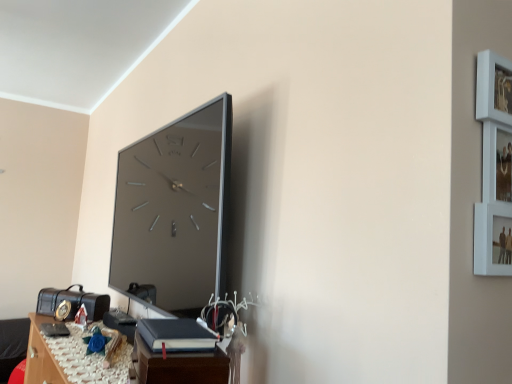
Question: Is wooden table at lower left, arranged as the second table when viewed from the right, not close to black leather book at lower center?

Choices:
 (A) no
 (B) yes

Answer: (A)

Question: Is wooden table at lower left, the 2th table in the top-to-bottom sequence, further to camera compared to black leather book at lower center?

Choices:
 (A) no
 (B) yes

Answer: (B)

Question: From a real-world perspective, is wooden table at lower left, which ranks as the 1th table in left-to-right order, located beneath black leather book at lower center?

Choices:
 (A) yes
 (B) no

Answer: (A)

Question: Is wooden table at lower left, the first table in the back-to-front sequence, surrounding black leather book at lower center?

Choices:
 (A) yes
 (B) no

Answer: (B)

Question: Does wooden table at lower left, the 2th table in the top-to-bottom sequence, come in front of black leather book at lower center?

Choices:
 (A) no
 (B) yes

Answer: (A)

Question: Is point (154, 375) closer or farther from the camera than point (174, 324)?

Choices:
 (A) closer
 (B) farther

Answer: (A)

Question: In the image, is wooden table at lower left, which is the second table from front to back, on the left side or the right side of black leather book at lower center?

Choices:
 (A) left
 (B) right

Answer: (A)

Question: Is wooden table at lower left, which ranks as the 1th table in left-to-right order, taller or shorter than black leather book at lower center?

Choices:
 (A) short
 (B) tall

Answer: (A)

Question: Which is correct: wooden table at lower left, arranged as the first table when ordered from the bottom, is inside black leather book at lower center, or outside of it?

Choices:
 (A) inside
 (B) outside

Answer: (B)

Question: In terms of width, does black leather book at lower center look wider or thinner when compared to dark brown wood table at lower center, arranged as the 1th table when viewed from the right?

Choices:
 (A) thin
 (B) wide

Answer: (A)

Question: Relative to dark brown wood table at lower center, arranged as the 1th table when viewed from the right, is black leather book at lower center in front or behind?

Choices:
 (A) front
 (B) behind

Answer: (B)

Question: From the image's perspective, is black leather book at lower center positioned above or below dark brown wood table at lower center, which is the 1th table from front to back?

Choices:
 (A) above
 (B) below

Answer: (A)

Question: From a real-world perspective, is black leather book at lower center above or below dark brown wood table at lower center, which is the 1th table from front to back?

Choices:
 (A) above
 (B) below

Answer: (A)

Question: Which is correct: dark brown wood table at lower center, placed as the 2th table when sorted from bottom to top, is inside black leather book at lower center, or outside of it?

Choices:
 (A) outside
 (B) inside

Answer: (A)

Question: From a real-world perspective, is dark brown wood table at lower center, which ranks as the second table in left-to-right order, positioned above or below black leather book at lower center?

Choices:
 (A) below
 (B) above

Answer: (A)